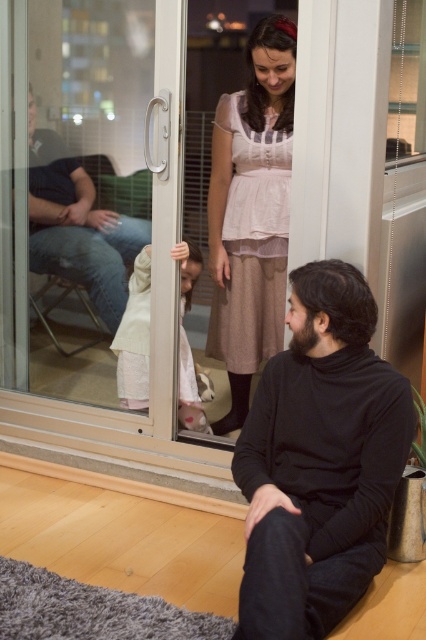
Question: Among these points, which one is farthest from the camera?

Choices:
 (A) (57, 244)
 (B) (247, 369)
 (C) (189, 252)
 (D) (301, 520)

Answer: (C)

Question: Which point is farther from the camera taking this photo?

Choices:
 (A) (147, 394)
 (B) (111, 211)

Answer: (B)

Question: Is pink fabric dress at center to the right of jeans at left from the viewer's perspective?

Choices:
 (A) no
 (B) yes

Answer: (B)

Question: Among these objects, which one is nearest to the camera?

Choices:
 (A) pink fabric dress at center
 (B) light pink fabric dress at center

Answer: (A)

Question: Can you confirm if jeans at left is thinner than light pink fabric dress at center?

Choices:
 (A) no
 (B) yes

Answer: (A)

Question: Where is black turtleneck sweater at center located in relation to pink fabric dress at center in the image?

Choices:
 (A) above
 (B) below

Answer: (B)